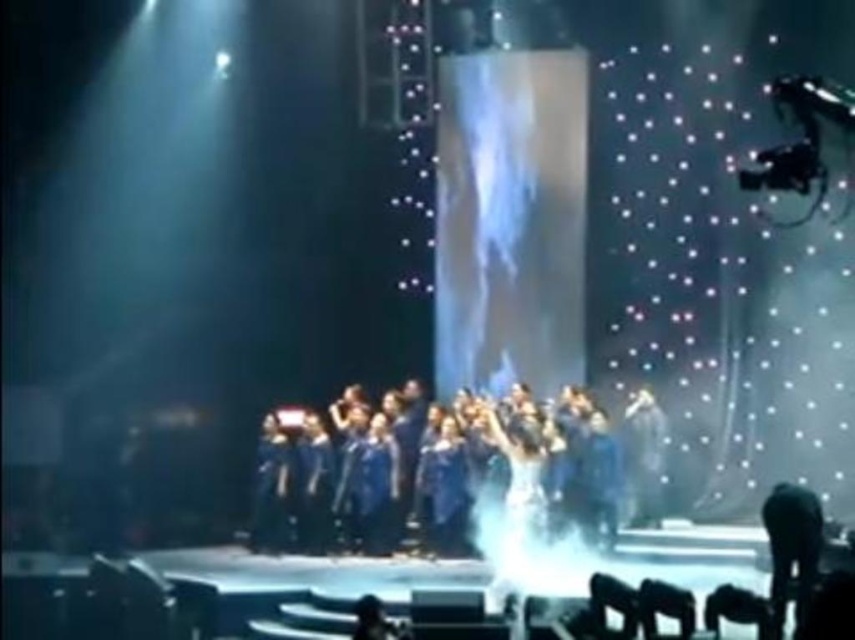
Which is below, blue fabric group at center or shiny silver dress at center?

blue fabric group at center is lower down.

Locate an element on the screen. blue fabric group at center is located at coordinates point(453,468).

The height and width of the screenshot is (640, 855). I want to click on blue fabric group at center, so (453, 468).

Can you confirm if black fabric microphone at lower right is positioned to the right of shiny silver dress at center?

Correct, you'll find black fabric microphone at lower right to the right of shiny silver dress at center.

Which of these two, black fabric microphone at lower right or shiny silver dress at center, stands shorter?

black fabric microphone at lower right is shorter.

This screenshot has height=640, width=855. I want to click on black fabric microphone at lower right, so click(x=792, y=548).

Does blue fabric group at center appear under black fabric microphone at lower right?

Yes, blue fabric group at center is below black fabric microphone at lower right.

I want to click on blue fabric group at center, so click(x=453, y=468).